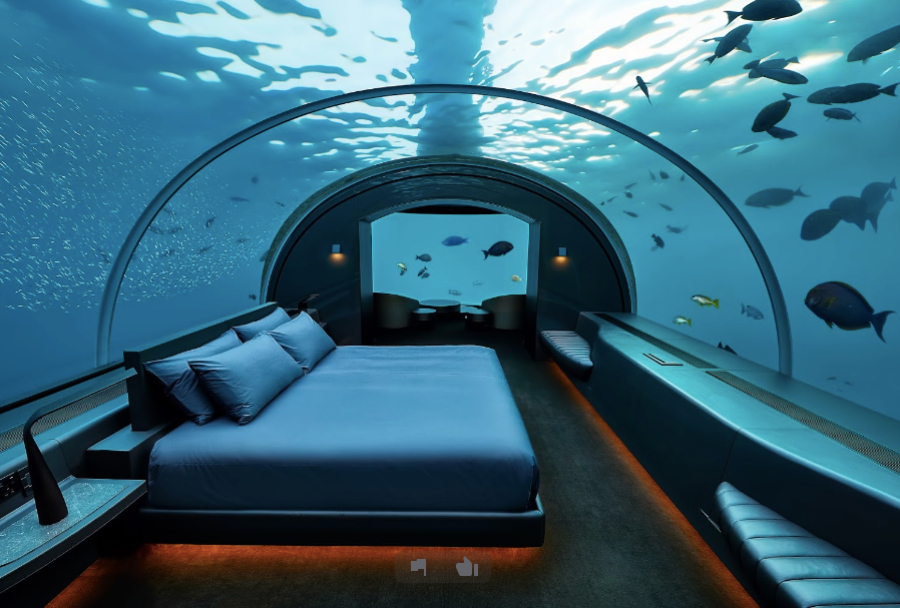
What are the coordinates of `bed` in the screenshot? It's located at (378, 379).